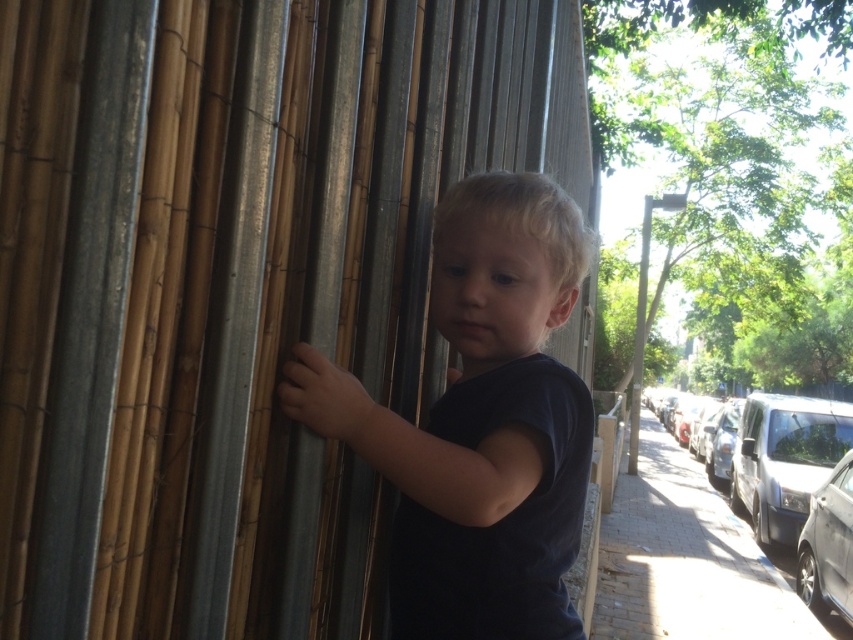
Question: Does natural bamboo forest at center come behind dark blue shirt at center?

Choices:
 (A) no
 (B) yes

Answer: (A)

Question: Does natural bamboo forest at center lie in front of dark blue shirt at center?

Choices:
 (A) yes
 (B) no

Answer: (A)

Question: Among these points, which one is nearest to the camera?

Choices:
 (A) (555, 637)
 (B) (78, 538)

Answer: (B)

Question: Which point is closer to the camera?

Choices:
 (A) natural bamboo forest at center
 (B) dark blue shirt at center

Answer: (A)

Question: In this image, where is natural bamboo forest at center located relative to dark blue shirt at center?

Choices:
 (A) left
 (B) right

Answer: (B)